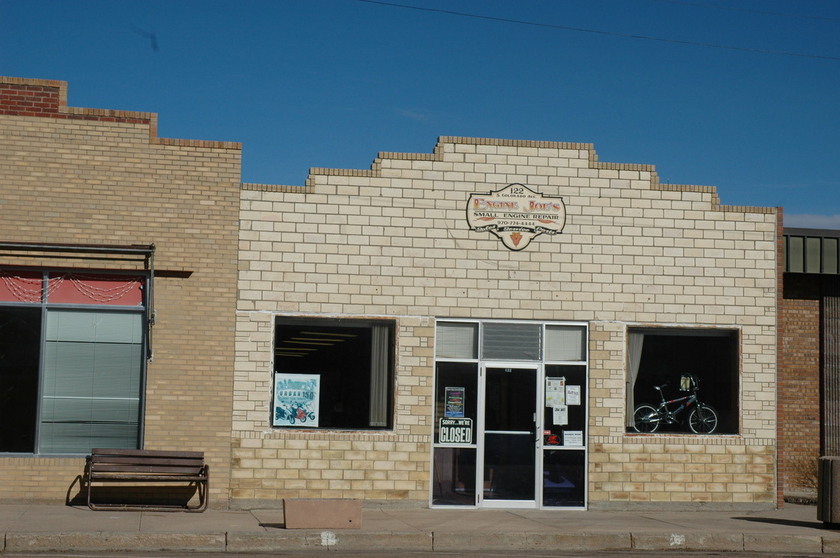
Locate an element on the screen. box is located at coordinates (318, 511).